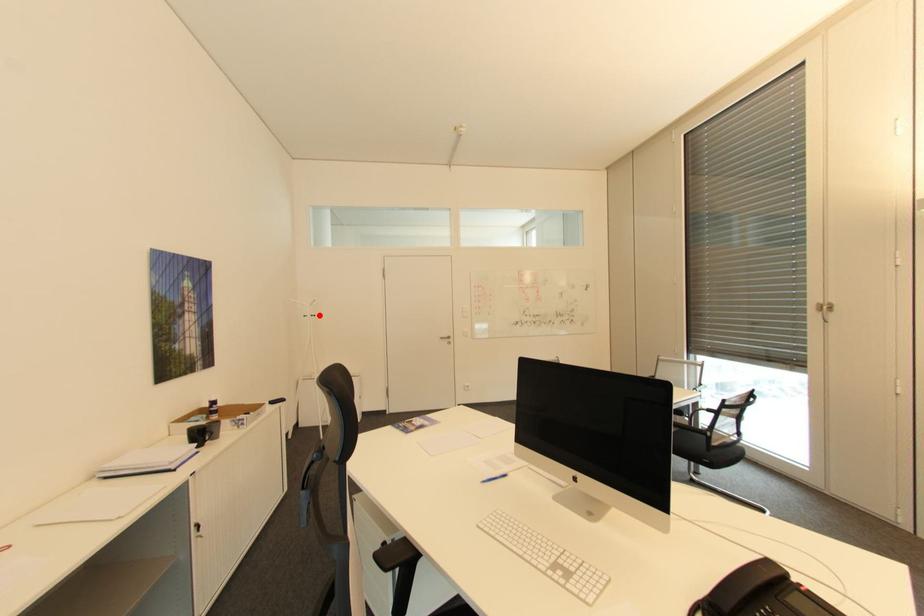
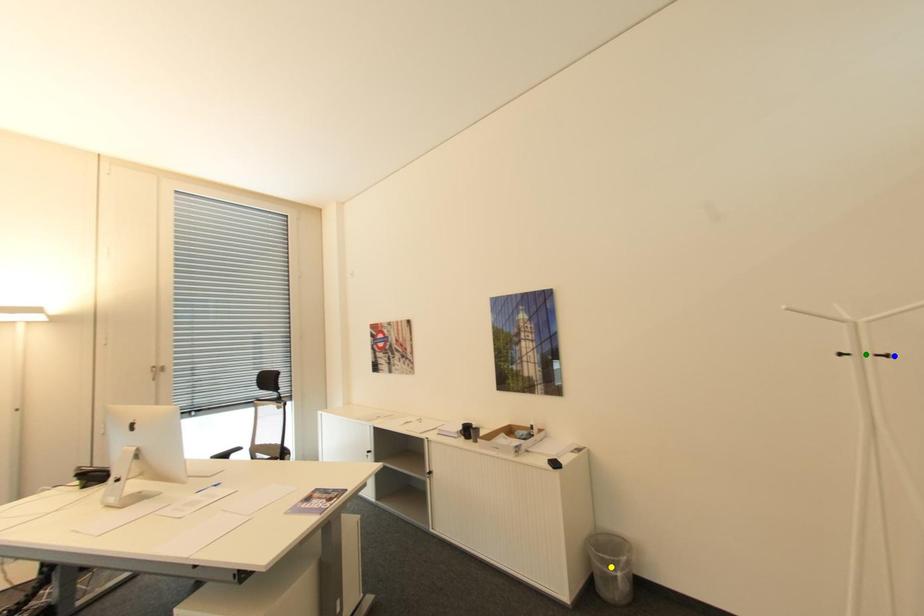
Question: I am providing you with two images of the same scene from different viewpoints. A red point is marked on the first image. You are given multiple points on the second image. Which spot in image 2 lines up with the point in image 1?

Choices:
 (A) blue point
 (B) green point
 (C) yellow point

Answer: (A)